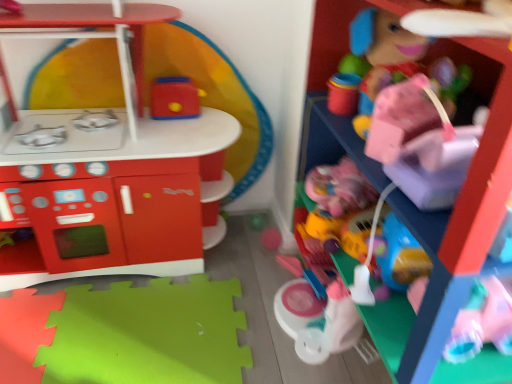
Question: Should I look upward or downward to see pink plastic toy at upper right, which ranks as the 4th toy in left-to-right order?

Choices:
 (A) down
 (B) up

Answer: (B)

Question: Is matte plastic play kitchen at left, which ranks as the 1th toy in left-to-right order, to the left of matte plastic toy car at right, which is the second toy from right to left, from the viewer's perspective?

Choices:
 (A) yes
 (B) no

Answer: (A)

Question: Is there a large distance between matte plastic play kitchen at left, positioned as the fourth toy in right-to-left order, and matte plastic toy car at right, which is counted as the 3th toy, starting from the left?

Choices:
 (A) yes
 (B) no

Answer: (B)

Question: Does matte plastic play kitchen at left, which ranks as the 1th toy in left-to-right order, lie behind matte plastic toy car at right, which is counted as the 3th toy, starting from the left?

Choices:
 (A) yes
 (B) no

Answer: (B)

Question: Can you confirm if matte plastic play kitchen at left, positioned as the fourth toy in right-to-left order, is positioned to the right of matte plastic toy car at right, which is counted as the 3th toy, starting from the left?

Choices:
 (A) yes
 (B) no

Answer: (B)

Question: Is matte plastic play kitchen at left, which ranks as the 1th toy in left-to-right order, closer to camera compared to matte plastic toy car at right, which is counted as the 3th toy, starting from the left?

Choices:
 (A) yes
 (B) no

Answer: (A)

Question: Would you say matte plastic play kitchen at left, positioned as the fourth toy in right-to-left order, contains matte plastic toy car at right, which is the second toy from right to left?

Choices:
 (A) no
 (B) yes

Answer: (A)

Question: Is matte plastic toaster at upper center, which is the third toy in right-to-left order, facing away from pink plastic toy at upper right, which ranks as the 4th toy in left-to-right order?

Choices:
 (A) yes
 (B) no

Answer: (B)

Question: Does matte plastic toaster at upper center, which is the second toy in left-to-right order, appear on the left side of pink plastic toy at upper right, the 1th toy viewed from the right?

Choices:
 (A) yes
 (B) no

Answer: (A)

Question: Is matte plastic toaster at upper center, which is the second toy in left-to-right order, at the right side of pink plastic toy at upper right, the 1th toy viewed from the right?

Choices:
 (A) no
 (B) yes

Answer: (A)

Question: Is pink plastic toy at upper right, which ranks as the 4th toy in left-to-right order, completely or partially inside matte plastic toaster at upper center, which is the third toy in right-to-left order?

Choices:
 (A) yes
 (B) no

Answer: (B)

Question: From a real-world perspective, does matte plastic toaster at upper center, which is the second toy in left-to-right order, sit lower than pink plastic toy at upper right, the 1th toy viewed from the right?

Choices:
 (A) yes
 (B) no

Answer: (B)

Question: Is matte plastic toaster at upper center, which is the second toy in left-to-right order, behind pink plastic toy at upper right, the 1th toy viewed from the right?

Choices:
 (A) no
 (B) yes

Answer: (B)

Question: Is matte plastic toy car at right, which is the second toy from right to left, positioned before pink plastic toy at upper right, which ranks as the 4th toy in left-to-right order?

Choices:
 (A) yes
 (B) no

Answer: (B)